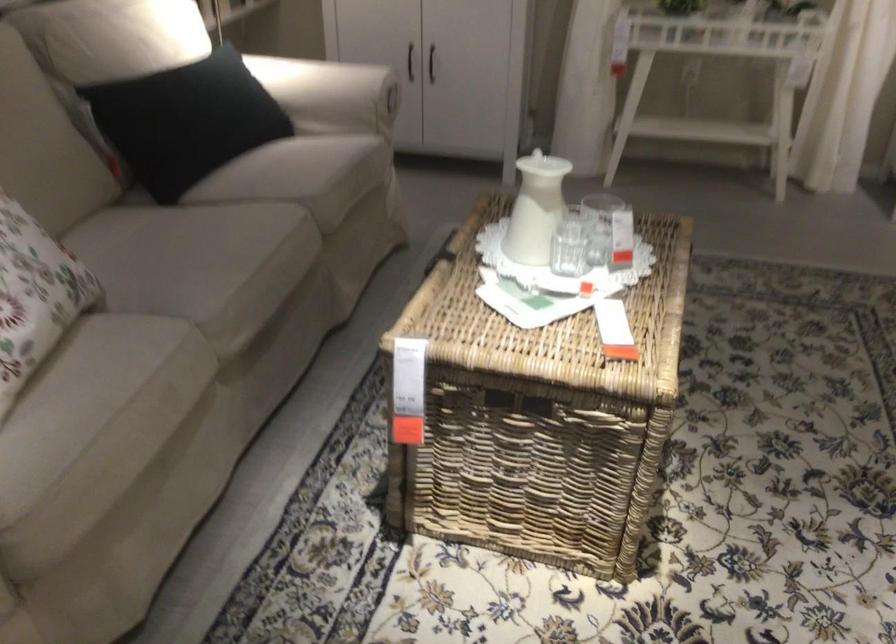
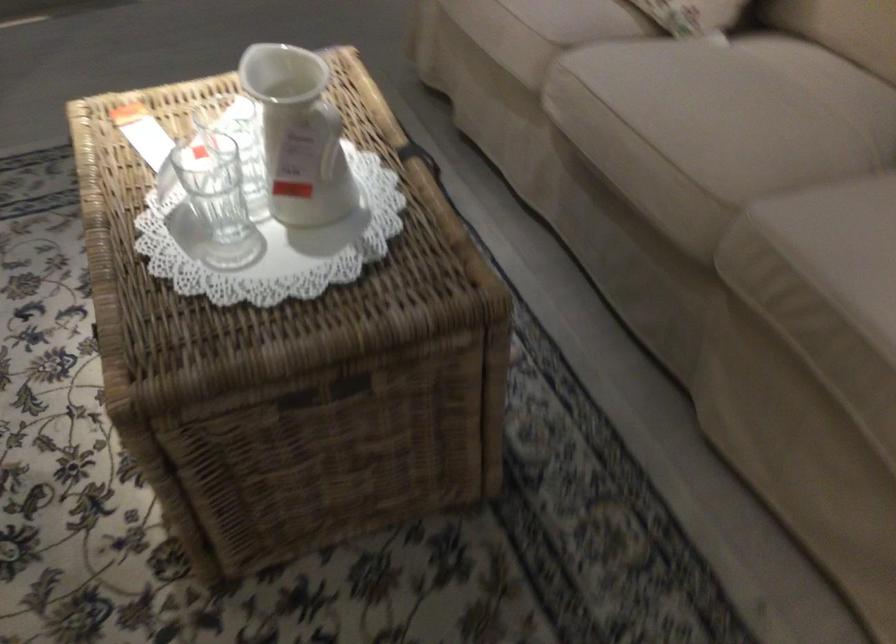
In the second image, find the point that corresponds to the point at 280,228 in the first image.

(704, 167)